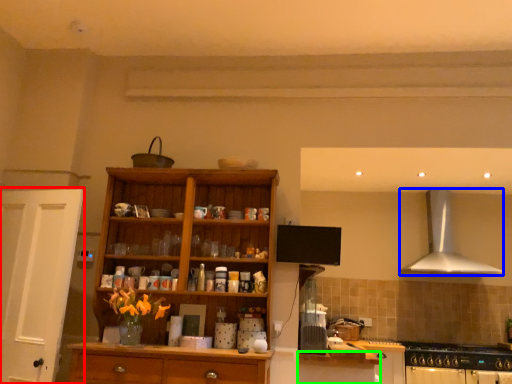
Question: Considering the real-world distances, which object is closest to door (highlighted by a red box)? kitchen appliance (highlighted by a blue box) or cabinetry (highlighted by a green box).

Choices:
 (A) kitchen appliance
 (B) cabinetry

Answer: (B)